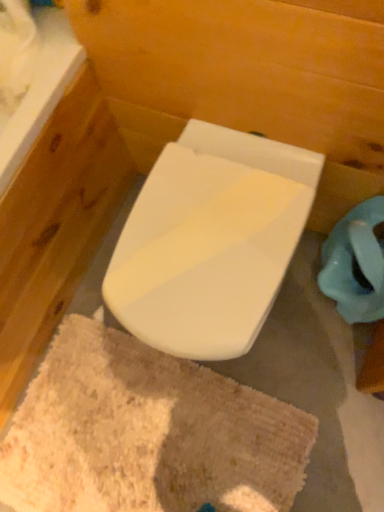
Question: From a real-world perspective, does white glossy toilet at center stand above beige shaggy bath mat at center?

Choices:
 (A) no
 (B) yes

Answer: (B)

Question: Is white glossy toilet at center thinner than beige shaggy bath mat at center?

Choices:
 (A) no
 (B) yes

Answer: (B)

Question: Could you tell me if white glossy toilet at center is turned towards beige shaggy bath mat at center?

Choices:
 (A) no
 (B) yes

Answer: (B)

Question: From the image's perspective, is white glossy toilet at center on beige shaggy bath mat at center?

Choices:
 (A) no
 (B) yes

Answer: (B)

Question: Is white glossy toilet at center taller than beige shaggy bath mat at center?

Choices:
 (A) no
 (B) yes

Answer: (B)

Question: Is white glossy toilet at center looking in the opposite direction of beige shaggy bath mat at center?

Choices:
 (A) yes
 (B) no

Answer: (B)

Question: From a real-world perspective, does beige shaggy bath mat at center sit lower than white glossy toilet at center?

Choices:
 (A) yes
 (B) no

Answer: (A)

Question: From the image's perspective, does beige shaggy bath mat at center appear lower than white glossy toilet at center?

Choices:
 (A) no
 (B) yes

Answer: (B)

Question: Considering the relative sizes of beige shaggy bath mat at center and white glossy toilet at center in the image provided, is beige shaggy bath mat at center wider than white glossy toilet at center?

Choices:
 (A) no
 (B) yes

Answer: (B)

Question: Is beige shaggy bath mat at center shorter than white glossy toilet at center?

Choices:
 (A) no
 (B) yes

Answer: (B)

Question: Considering the relative sizes of beige shaggy bath mat at center and white glossy toilet at center in the image provided, is beige shaggy bath mat at center smaller than white glossy toilet at center?

Choices:
 (A) yes
 (B) no

Answer: (A)

Question: Is beige shaggy bath mat at center facing towards white glossy toilet at center?

Choices:
 (A) yes
 (B) no

Answer: (B)

Question: Is beige shaggy bath mat at center wider or thinner than white glossy toilet at center?

Choices:
 (A) wide
 (B) thin

Answer: (A)